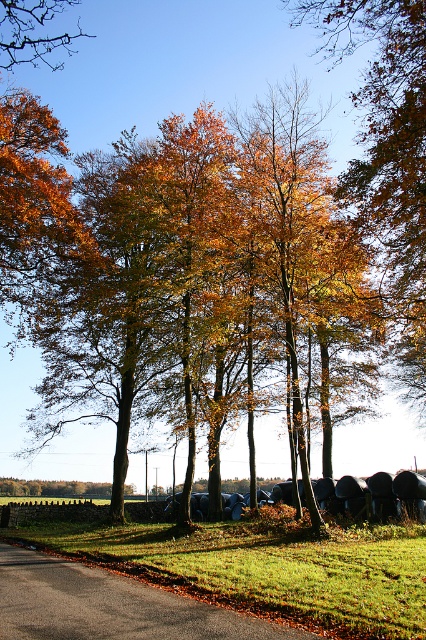
Between golden leaves at center and brown leafy tree at upper left, which one is positioned lower?

Positioned lower is golden leaves at center.

Does golden leaves at center appear under brown leafy tree at upper left?

Correct, golden leaves at center is located below brown leafy tree at upper left.

Which is behind, point (163, 248) or point (20, 10)?

Point (20, 10)

Locate an element on the screen. The height and width of the screenshot is (640, 426). golden leaves at center is located at coordinates (206, 289).

Can you confirm if green grass at lower center is shorter than brown leafy tree at upper left?

Yes, green grass at lower center is shorter than brown leafy tree at upper left.

Is green grass at lower center to the left of brown leafy tree at upper left from the viewer's perspective?

No, green grass at lower center is not to the left of brown leafy tree at upper left.

Is point (215, 600) positioned before point (5, 28)?

Yes, it is.

The height and width of the screenshot is (640, 426). In order to click on green grass at lower center in this screenshot , I will do click(267, 566).

Can you confirm if golden leaves at center is positioned to the left of green grass at lower center?

Yes, golden leaves at center is to the left of green grass at lower center.

Is point (245, 275) positioned before point (137, 536)?

No, it is behind (137, 536).

Does point (342, 403) lie behind point (235, 596)?

Yes, it is.

Identify the location of golden leaves at center. This screenshot has height=640, width=426. point(206,289).